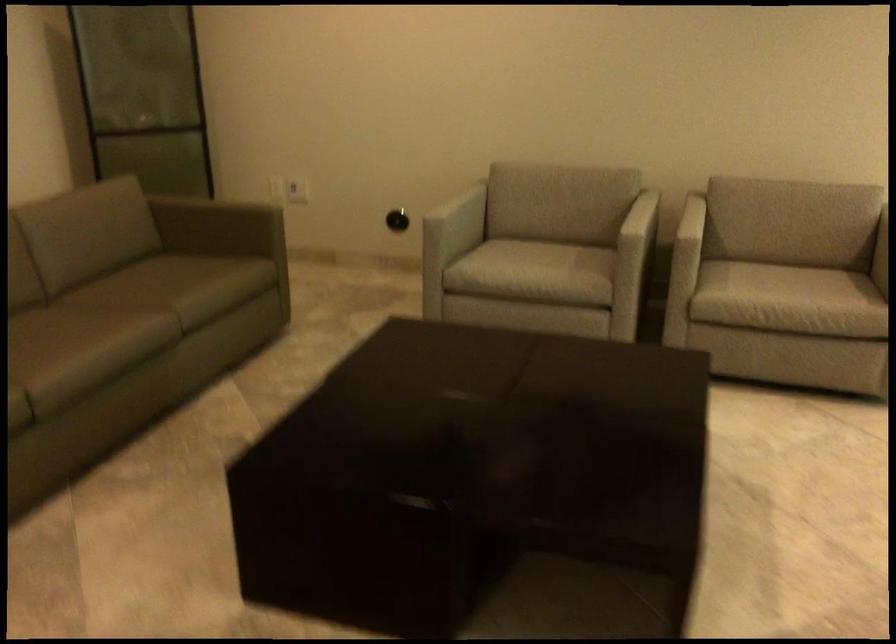
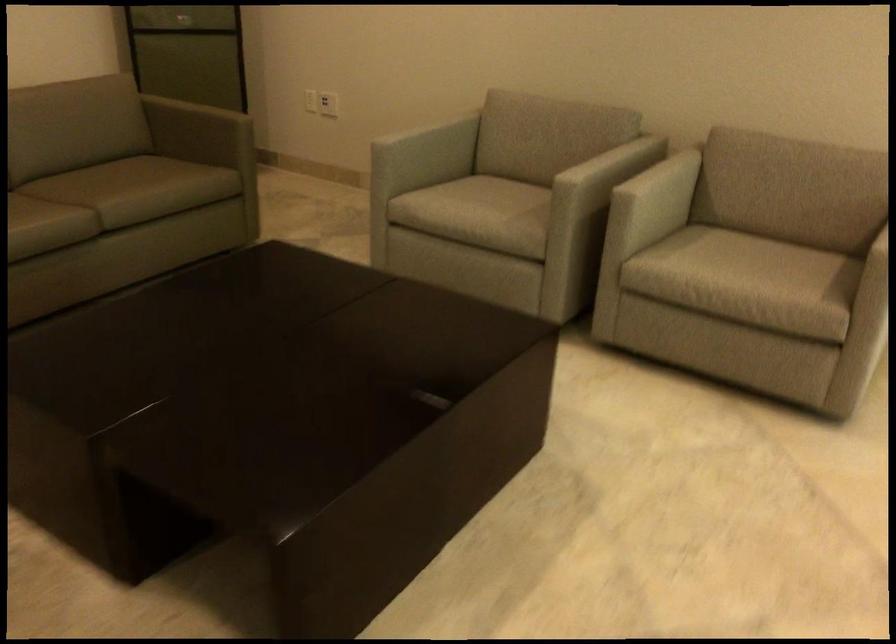
Find the pixel in the second image that matches pixel 449 196 in the first image.

(423, 127)